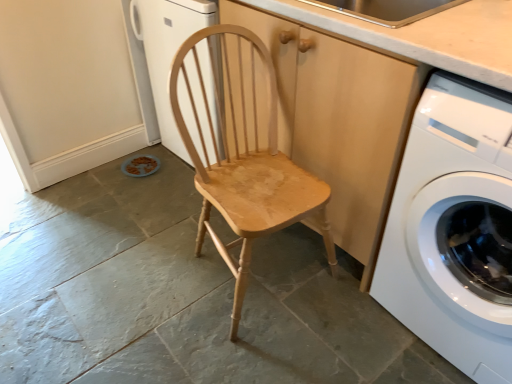
Question: Is natural wood chair at center taller than white glossy washing machine at right?

Choices:
 (A) no
 (B) yes

Answer: (A)

Question: Does natural wood chair at center have a lesser width compared to white glossy washing machine at right?

Choices:
 (A) yes
 (B) no

Answer: (A)

Question: From a real-world perspective, is natural wood chair at center physically below white glossy washing machine at right?

Choices:
 (A) no
 (B) yes

Answer: (B)

Question: From the image's perspective, is natural wood chair at center on top of white glossy washing machine at right?

Choices:
 (A) yes
 (B) no

Answer: (A)

Question: Is natural wood chair at center located outside white glossy washing machine at right?

Choices:
 (A) yes
 (B) no

Answer: (A)

Question: Considering the positions of wooden cabinet at center and light brown wood at upper center in the image, is wooden cabinet at center bigger or smaller than light brown wood at upper center?

Choices:
 (A) big
 (B) small

Answer: (A)

Question: Is wooden cabinet at center wider or thinner than light brown wood at upper center?

Choices:
 (A) thin
 (B) wide

Answer: (B)

Question: Is point (381, 185) positioned closer to the camera than point (451, 61)?

Choices:
 (A) closer
 (B) farther

Answer: (B)

Question: Based on their positions, is wooden cabinet at center located to the left or right of light brown wood at upper center?

Choices:
 (A) left
 (B) right

Answer: (B)

Question: Is natural wood chair at center bigger or smaller than light brown wood at upper center?

Choices:
 (A) small
 (B) big

Answer: (B)

Question: From the image's perspective, is natural wood chair at center positioned above or below light brown wood at upper center?

Choices:
 (A) below
 (B) above

Answer: (A)

Question: From their relative heights in the image, would you say natural wood chair at center is taller or shorter than light brown wood at upper center?

Choices:
 (A) tall
 (B) short

Answer: (A)

Question: Considering the positions of point (239, 261) and point (368, 36), is point (239, 261) closer or farther from the camera than point (368, 36)?

Choices:
 (A) closer
 (B) farther

Answer: (B)

Question: Is point (464, 18) closer or farther from the camera than point (198, 74)?

Choices:
 (A) farther
 (B) closer

Answer: (B)

Question: Choose the correct answer: Is light brown wood at upper center inside natural wood chair at center or outside it?

Choices:
 (A) inside
 (B) outside

Answer: (B)